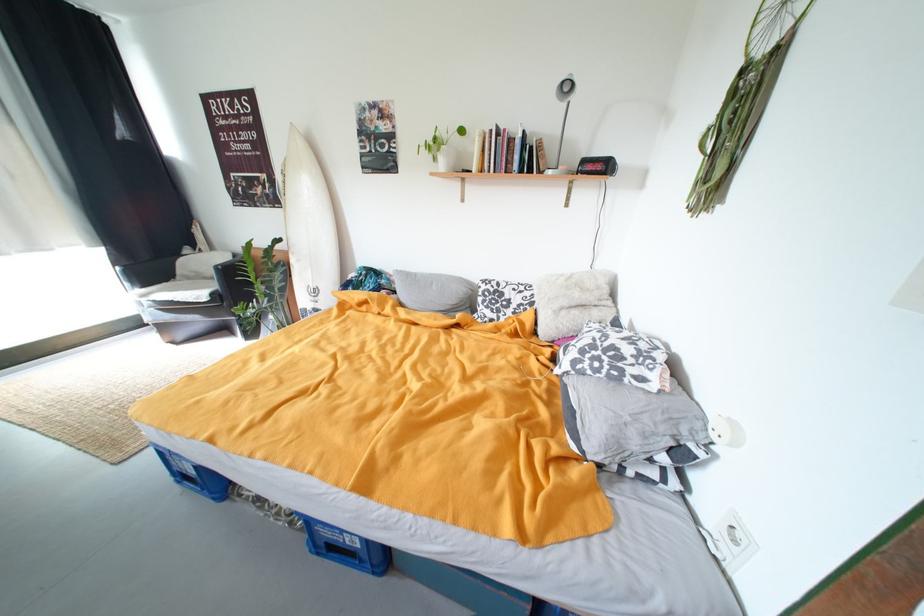
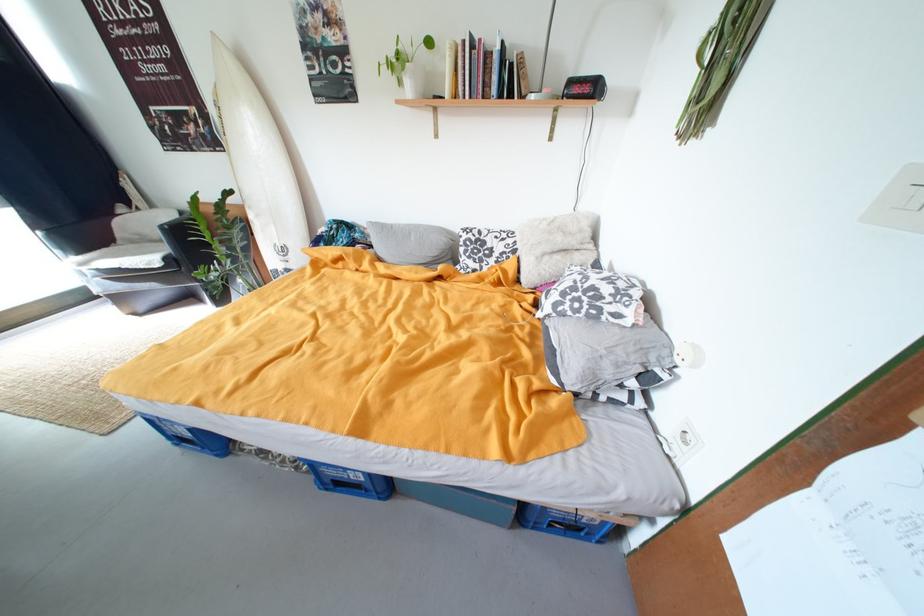
Where in the second image is the point corresponding to the point at 313,538 from the first image?

(321, 479)